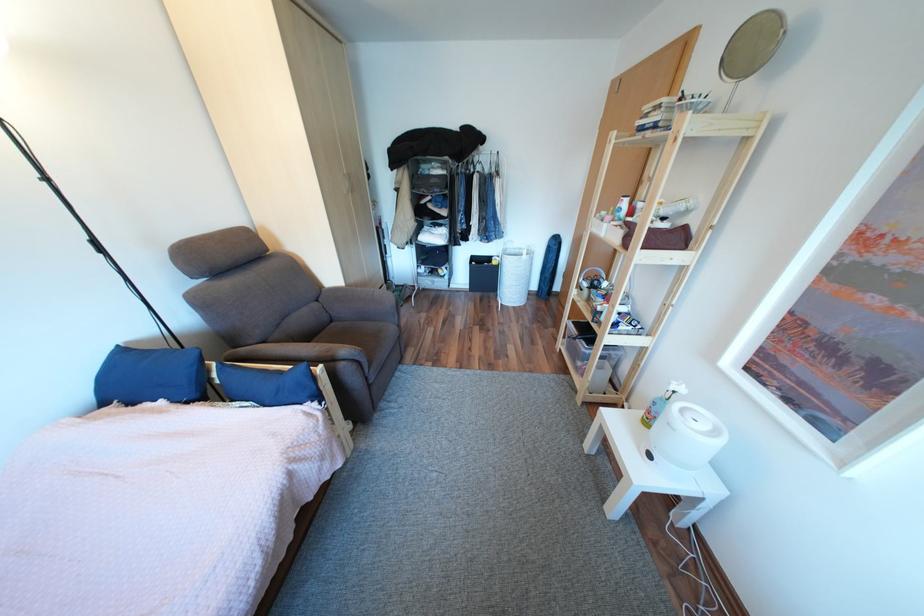
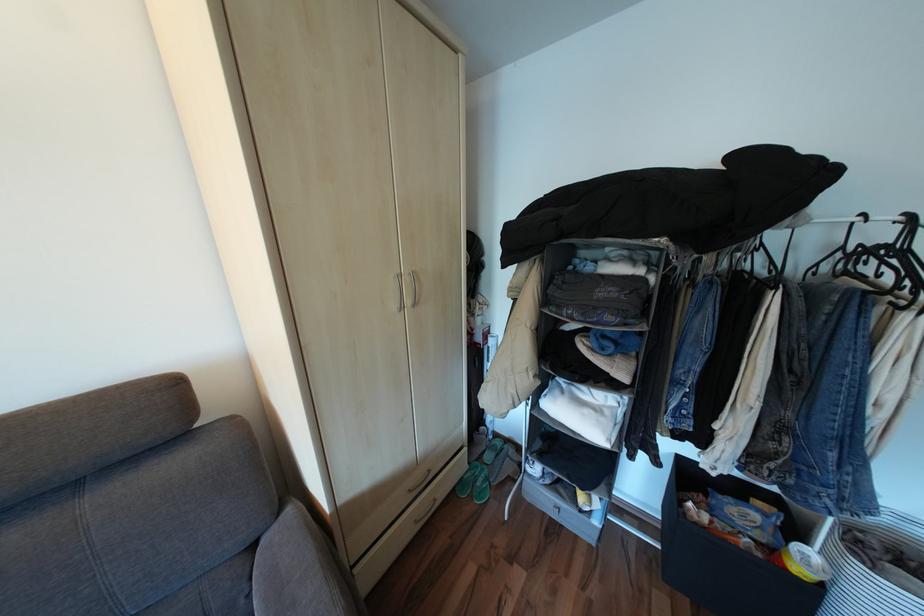
Find the pixel in the second image that matches point (329, 301) in the first image.

(263, 545)